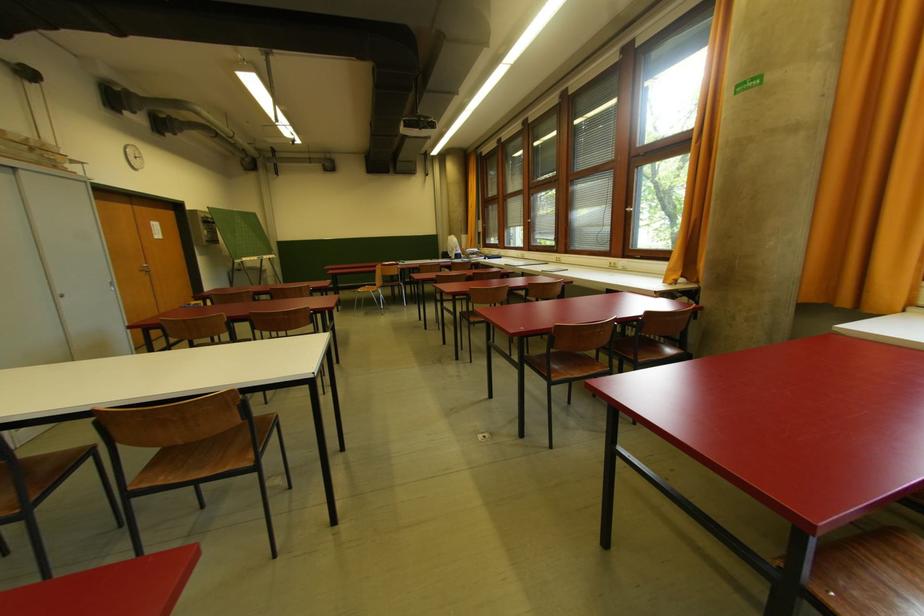
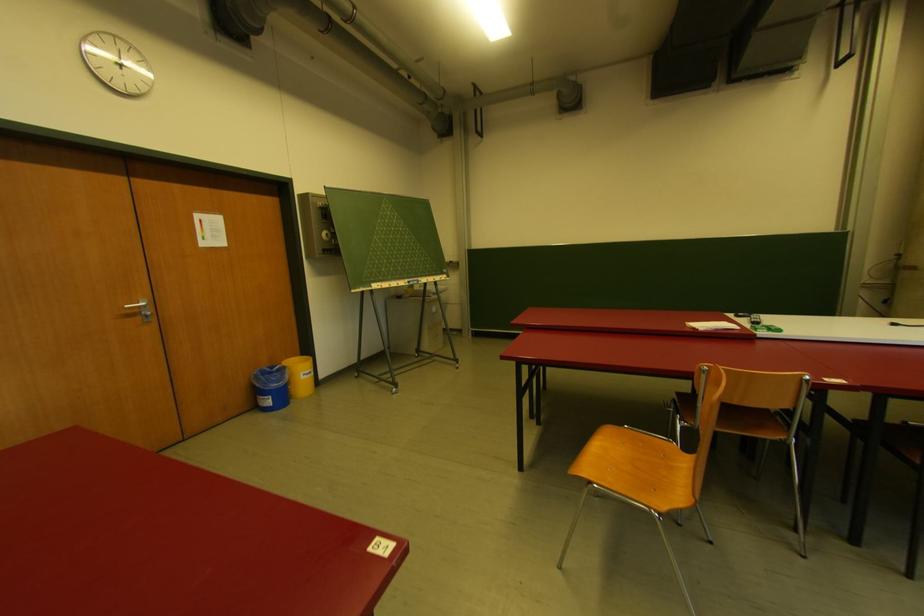
Where in the second image is the point corresponding to the point at 210,243 from the first image?

(326, 252)